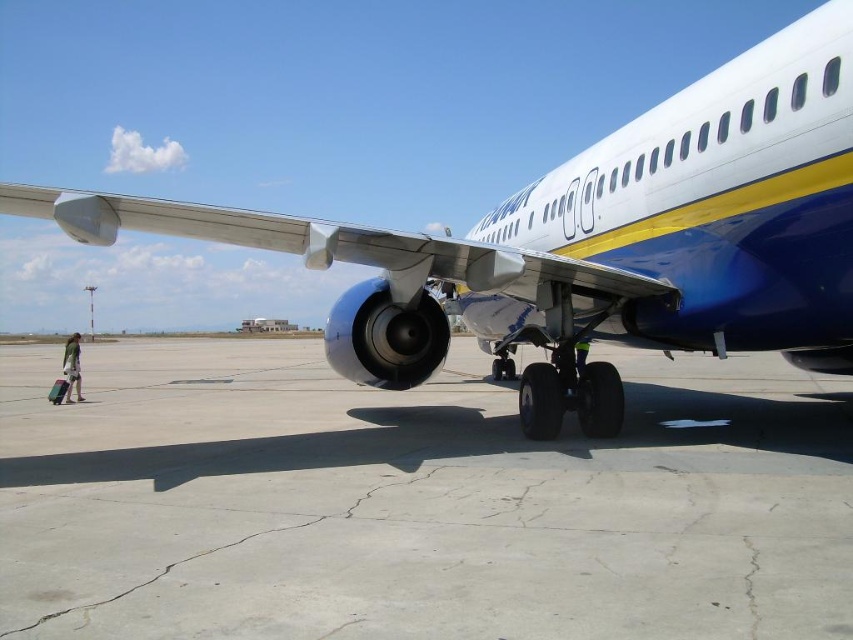
Question: Is gray concrete tarmac at center closer to the viewer compared to white glossy airplane at center?

Choices:
 (A) no
 (B) yes

Answer: (B)

Question: Does gray concrete tarmac at center appear on the left side of white glossy airplane at center?

Choices:
 (A) no
 (B) yes

Answer: (B)

Question: Can you confirm if gray concrete tarmac at center is positioned below white glossy airplane at center?

Choices:
 (A) yes
 (B) no

Answer: (A)

Question: Which object appears closest to the camera in this image?

Choices:
 (A) white glossy airplane at center
 (B) gray concrete tarmac at center

Answer: (B)

Question: Among these objects, which one is nearest to the camera?

Choices:
 (A) white glossy airplane at center
 (B) gray concrete tarmac at center

Answer: (B)